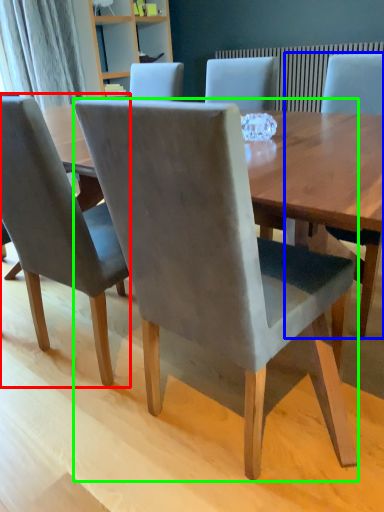
Question: Estimate the real-world distances between objects in this image. Which object is closer to chair (highlighted by a red box), chair (highlighted by a blue box) or chair (highlighted by a green box)?

Choices:
 (A) chair
 (B) chair

Answer: (B)